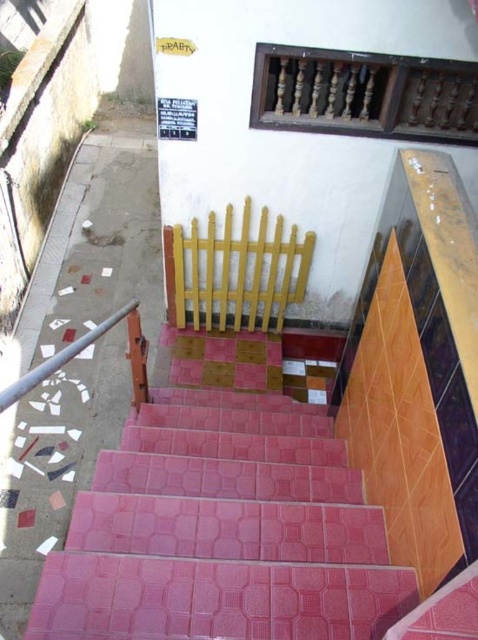
You are standing at the bottom of the staircase and want to reach the wooden balustrade at upper center. Which direction should you move in to get closer to it?

The wooden balustrade at upper center is located at point (365, 93) in 2D coordinates, so you should move upwards and slightly to the left to reach it.

You are standing at the bottom of the staircase and want to grab the metallic pole at left to steady yourself. Which direction should you move relative to the wooden balustrade at upper center to reach it?

The wooden balustrade at upper center is positioned on the right side of the metallic pole at left, so to reach the metallic pole at left, you should move to the left relative to the wooden balustrade at upper center.